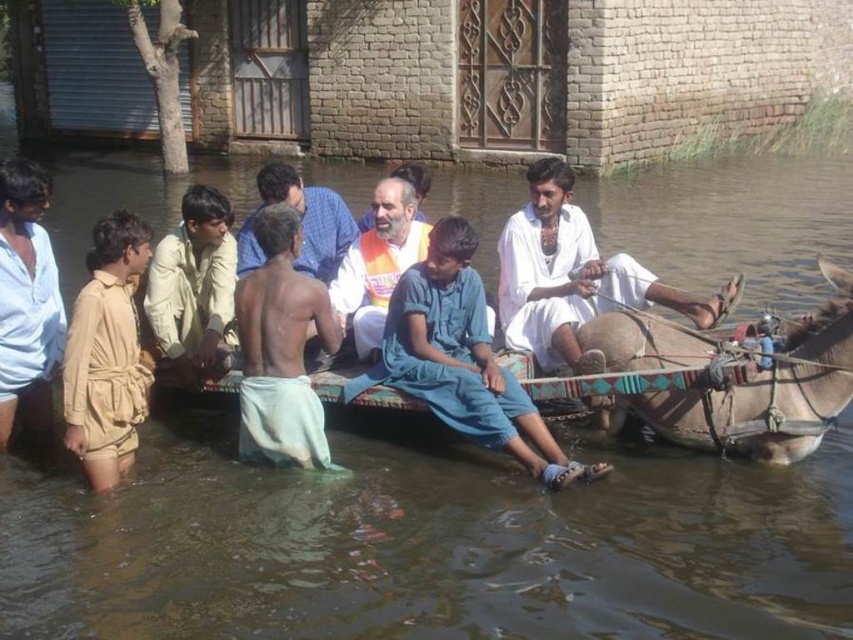
You are a photographer trying to capture a photo of the light brown cotton shorts at lower left and the white cotton shirt at center. Which clothing item is located to the left of the other?

The light brown cotton shorts at lower left is positioned on the left side of white cotton shirt at center.

You are a photographer trying to capture the entire scene of the brown rough hide mule at right and the shiny white cloth at center in a single frame. Which object should you position closer to the camera to ensure both fit in the photo?

To capture both the brown rough hide mule at right and the shiny white cloth at center in a single frame, position the shiny white cloth at center closer to the camera. Since the brown rough hide mule at right is wider than the shiny white cloth at center, moving the narrower object forward will help balance their sizes in the photo.

You are a photographer trying to capture a clear shot of both the tan fabric jumpsuit at left and the light brown cotton shorts at lower left. Since you want both subjects in focus, you need to adjust your camera settings. Which subject should you focus on first to ensure both are in the frame?

You should focus on the tan fabric jumpsuit at left first because it is closer to the viewer than the light brown cotton shorts at lower left. By focusing on the closer subject, the farther one will also be in focus due to the depth of field.